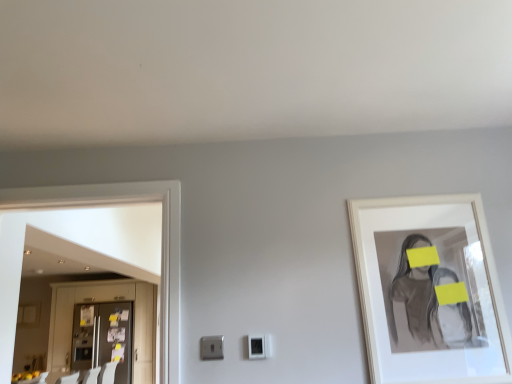
Question: From a real-world perspective, is white plastic electric outlet at center under metallic refrigerator at left?

Choices:
 (A) no
 (B) yes

Answer: (A)

Question: Can you confirm if white plastic electric outlet at center is shorter than metallic refrigerator at left?

Choices:
 (A) no
 (B) yes

Answer: (B)

Question: Can you confirm if white plastic electric outlet at center is positioned to the right of metallic refrigerator at left?

Choices:
 (A) yes
 (B) no

Answer: (A)

Question: Are white plastic electric outlet at center and metallic refrigerator at left far apart?

Choices:
 (A) yes
 (B) no

Answer: (A)

Question: Is white plastic electric outlet at center smaller than metallic refrigerator at left?

Choices:
 (A) no
 (B) yes

Answer: (B)

Question: From the image's perspective, is white plastic electric outlet at center beneath metallic refrigerator at left?

Choices:
 (A) yes
 (B) no

Answer: (B)

Question: Is metallic refrigerator at left smaller than white matte picture frame at upper right?

Choices:
 (A) no
 (B) yes

Answer: (A)

Question: From the image's perspective, is metallic refrigerator at left beneath white matte picture frame at upper right?

Choices:
 (A) no
 (B) yes

Answer: (B)

Question: Is metallic refrigerator at left to the left of white matte picture frame at upper right from the viewer's perspective?

Choices:
 (A) yes
 (B) no

Answer: (A)

Question: Is metallic refrigerator at left bigger than white matte picture frame at upper right?

Choices:
 (A) yes
 (B) no

Answer: (A)

Question: Is metallic refrigerator at left further to the viewer compared to white matte picture frame at upper right?

Choices:
 (A) no
 (B) yes

Answer: (B)

Question: Is metallic refrigerator at left touching white matte picture frame at upper right?

Choices:
 (A) no
 (B) yes

Answer: (A)

Question: Is metallic refrigerator at left completely or partially outside of white plastic electric outlet at center?

Choices:
 (A) no
 (B) yes

Answer: (B)